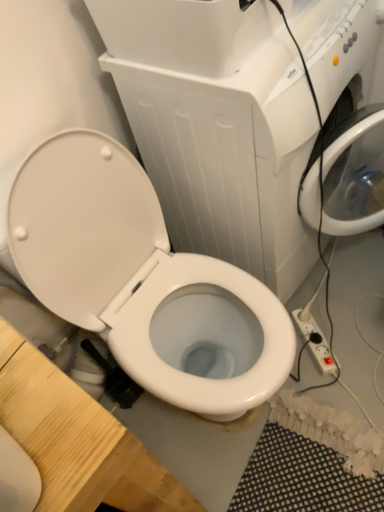
Question: Is white plastic power strip at lower right inside the boundaries of white glossy toilet at center, or outside?

Choices:
 (A) outside
 (B) inside

Answer: (A)

Question: In terms of height, does white plastic power strip at lower right look taller or shorter compared to white glossy toilet at center?

Choices:
 (A) tall
 (B) short

Answer: (B)

Question: Which of these objects is positioned farthest from the white plastic power strip at lower right?

Choices:
 (A) white glossy toilet at center
 (B) white glossy toilet at center

Answer: (A)

Question: Considering the real-world distances, which object is closest to the white glossy toilet at center?

Choices:
 (A) white plastic power strip at lower right
 (B) white glossy toilet at center

Answer: (B)